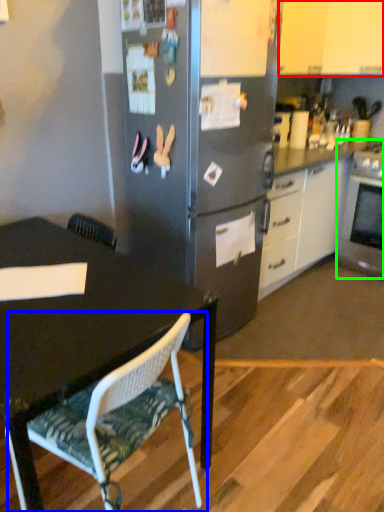
Question: Considering the real-world distances, which object is farthest from cabinetry (highlighted by a red box)? chair (highlighted by a blue box) or oven (highlighted by a green box)?

Choices:
 (A) chair
 (B) oven

Answer: (A)